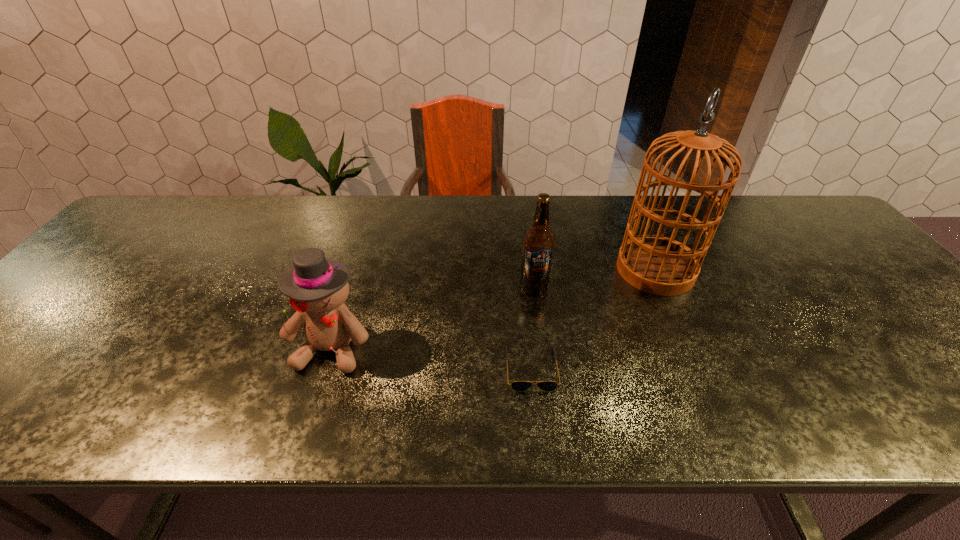
Where is `birdcage`? birdcage is located at coordinates (658, 265).

Locate an element on the screen. This screenshot has width=960, height=540. the rightmost object is located at coordinates (658, 265).

The image size is (960, 540). I want to click on beer bottle, so click(x=538, y=244).

Find the location of a particular element. This screenshot has width=960, height=540. rag_doll is located at coordinates (317, 288).

At what (x,y) coordinates should I click in order to perform the action: click on sunglasses. Please return your answer as a coordinate pair (x, y). The width and height of the screenshot is (960, 540). Looking at the image, I should click on (519, 386).

Where is `vacant space located 0.230m on the right of the birdcage`? The image size is (960, 540). vacant space located 0.230m on the right of the birdcage is located at coordinates (780, 269).

This screenshot has width=960, height=540. I want to click on vacant area situated 0.120m on the label of the beer bottle, so click(x=540, y=334).

Identify the location of vacant space positioned 0.050m on the front-facing side of the leftmost object. This screenshot has width=960, height=540. (316, 397).

This screenshot has height=540, width=960. I want to click on vacant space located 0.070m on the front-facing side of the shortest object, so click(537, 423).

Locate an element on the screen. The height and width of the screenshot is (540, 960). free space at the far edge is located at coordinates (562, 208).